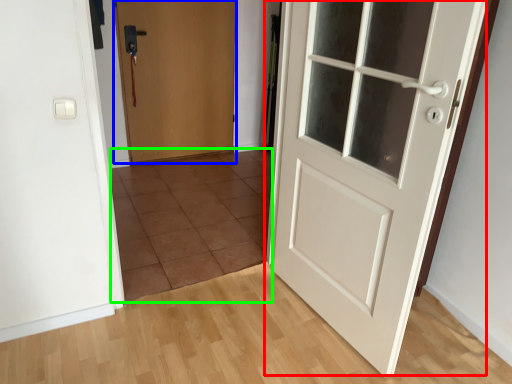
Question: Considering the real-world distances, which object is closest to door (highlighted by a red box)? door (highlighted by a blue box) or tile (highlighted by a green box).

Choices:
 (A) door
 (B) tile

Answer: (B)